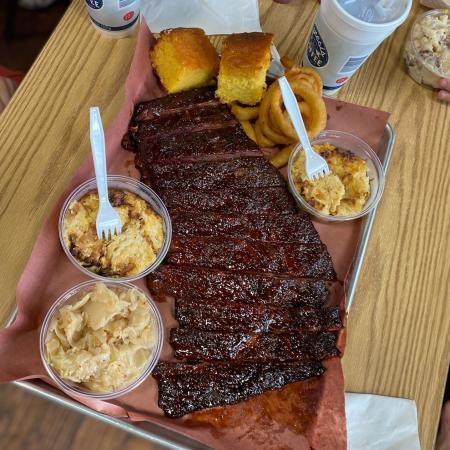
Identify the location of clear bowl. The height and width of the screenshot is (450, 450). (379, 173).